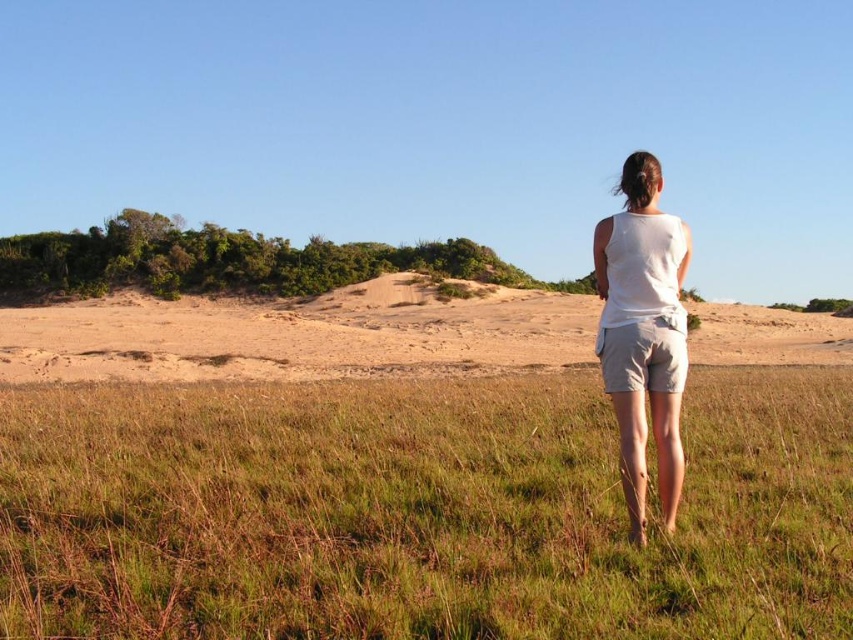
Is brown dry grass at center in front of white cotton tank top at center?

Yes.

Does point (229, 618) come farther from viewer compared to point (645, 486)?

No, it is not.

Locate an element on the screen. Image resolution: width=853 pixels, height=640 pixels. brown dry grass at center is located at coordinates (421, 512).

Can you confirm if brown dry grass at center is positioned below white cotton shorts at center?

Yes, brown dry grass at center is below white cotton shorts at center.

The image size is (853, 640). What are the coordinates of `brown dry grass at center` in the screenshot? It's located at (421, 512).

Identify the location of brown dry grass at center. The image size is (853, 640). (421, 512).

Identify the location of brown dry grass at center. (421, 512).

Consider the image. Which is below, white cotton tank top at center or white cotton shorts at center?

white cotton shorts at center

Which is more to the right, white cotton tank top at center or white cotton shorts at center?

white cotton tank top at center

Between point (657, 356) and point (618, 342), which one is positioned behind?

The point (657, 356) is more distant.

Identify the location of white cotton tank top at center. (643, 332).